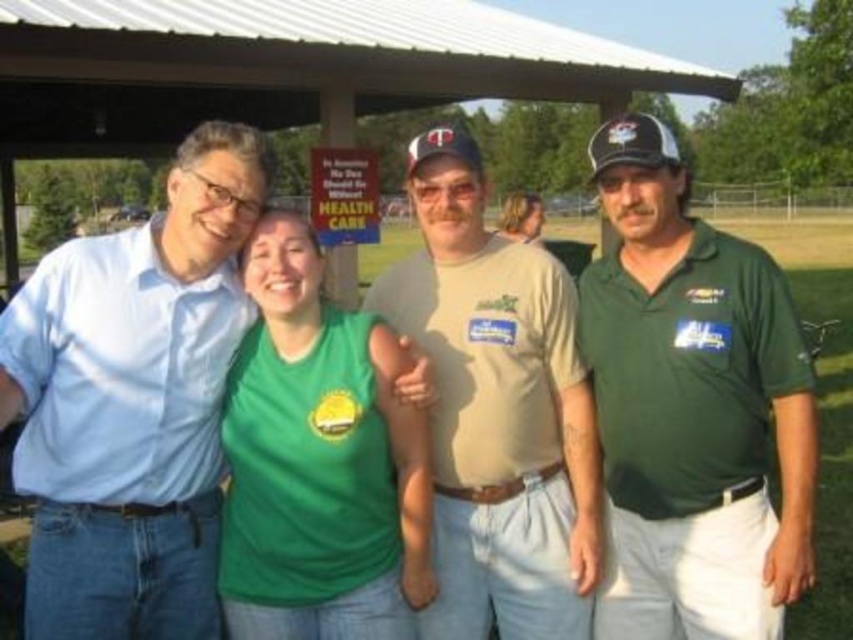
Question: Considering the relative positions of matte blue shirt at center and green cotton polo shirt at right in the image provided, where is matte blue shirt at center located with respect to green cotton polo shirt at right?

Choices:
 (A) left
 (B) right

Answer: (A)

Question: Which of the following is the farthest from the observer?

Choices:
 (A) (624, 288)
 (B) (138, 552)
 (C) (821, 310)

Answer: (C)

Question: Based on their relative distances, which object is nearer to the tan cotton t-shirt at center?

Choices:
 (A) green cotton polo shirt at right
 (B) matte blue shirt at center
 (C) green grass at center

Answer: (A)

Question: Is matte blue shirt at center closer to the viewer compared to green grass at center?

Choices:
 (A) no
 (B) yes

Answer: (B)

Question: Does tan cotton t-shirt at center appear on the left side of green grass at center?

Choices:
 (A) no
 (B) yes

Answer: (B)

Question: Which object is the farthest from the matte blue shirt at center?

Choices:
 (A) green grass at center
 (B) tan cotton t-shirt at center
 (C) green cotton polo shirt at right

Answer: (A)